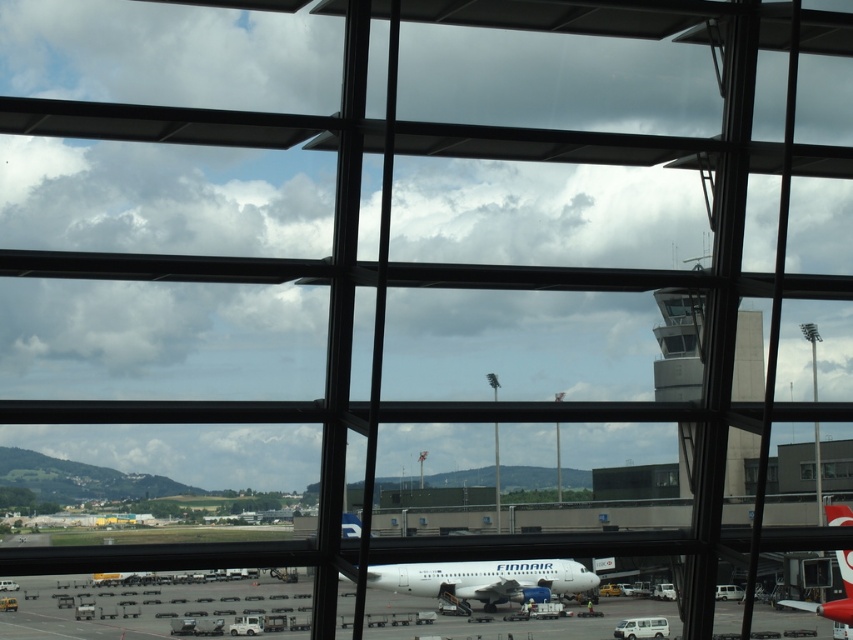
Is point (677, 435) in front of point (759, 461)?

No.

Is concrete control tower at upper right wider than transparent glass window at center?

Yes.

Where is `concrete control tower at upper right`? The image size is (853, 640). concrete control tower at upper right is located at coordinates (679, 344).

You are a GUI agent. You are given a task and a screenshot of the screen. Output one action in this format:
    pyautogui.click(x=<x>, y=<y>)
    Task: Click on the concrete control tower at upper right
    Image resolution: width=853 pixels, height=640 pixels.
    Given the screenshot: What is the action you would take?
    pyautogui.click(x=679, y=344)

Looking at this image, between white glossy airplane at center and concrete control tower at upper right, which one is positioned lower?

white glossy airplane at center

Who is more distant from viewer, (262, 595) or (758, 316)?

Positioned behind is point (758, 316).

Image resolution: width=853 pixels, height=640 pixels. Identify the location of white glossy airplane at center. tap(136, 605).

From the picture: Is concrete control tower at upper right to the right of white glossy airplane at lower right from the viewer's perspective?

Incorrect, concrete control tower at upper right is not on the right side of white glossy airplane at lower right.

Can you confirm if concrete control tower at upper right is smaller than white glossy airplane at lower right?

No, concrete control tower at upper right is not smaller than white glossy airplane at lower right.

Who is more distant from viewer, (691, 438) or (844, 520)?

The point (844, 520) is behind.

This screenshot has height=640, width=853. What are the coordinates of `concrete control tower at upper right` in the screenshot? It's located at (679, 344).